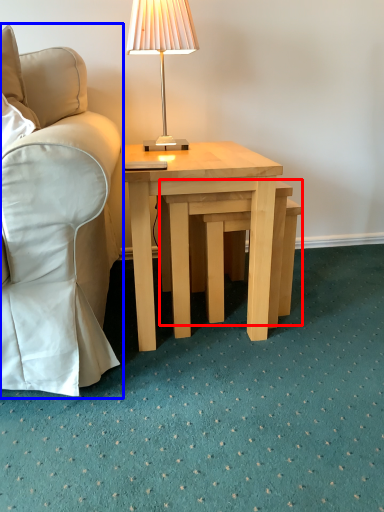
Question: Which of the following is the closest to the observer, step stool (highlighted by a red box) or chair (highlighted by a blue box)?

Choices:
 (A) step stool
 (B) chair

Answer: (B)